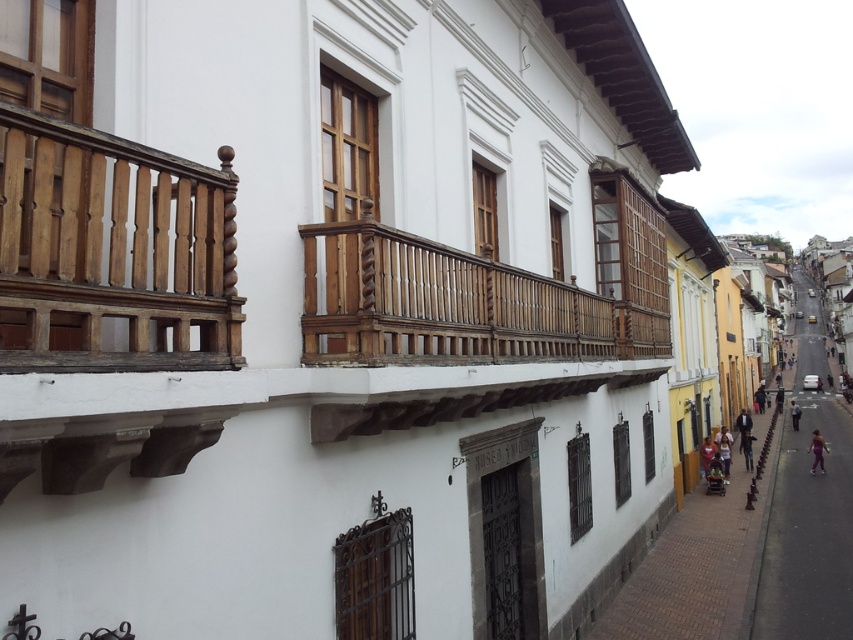
Based on the photo, you are a delivery person standing on the asphalt road at lower right, and you need to deliver a package to the wooden polished balcony at upper left. The delivery robot you use has a maximum range of 15 meters. Can the robot reach the balcony from your current position?

The distance between the wooden polished balcony at upper left and the asphalt road at lower right is 14.22 meters, which is within the robot s 15 meter range. Therefore, the robot can successfully reach the balcony.

You are a pedestrian standing on the asphalt road at lower right. You want to step onto the light blue jeans at lower right. Is this possible given their spatial relationship?

The asphalt road at lower right is above light blue jeans at lower right, so stepping onto the light blue jeans at lower right would require moving downward from the asphalt road at lower right.

You are a delivery person standing on the street in front of the white buildings with wooden balconies. You need to place a package on the wooden at center without it falling onto the purple fabric pants at lower right. How should you position the package?

The wooden at center is positioned over the purple fabric pants at lower right, so placing the package on the wooden at center would be safe as it is above and not directly over the purple fabric pants at lower right.